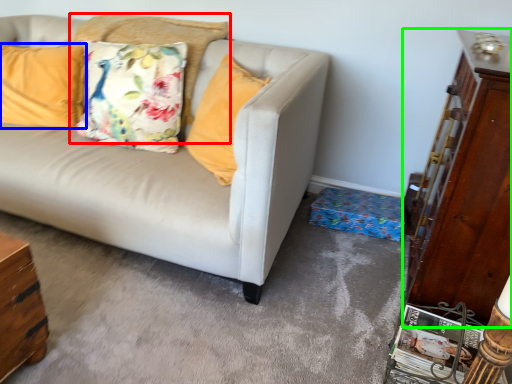
Question: Based on their relative distances, which object is farther from pillow (highlighted by a red box)? Choose from pillow (highlighted by a blue box) and dresser (highlighted by a green box).

Choices:
 (A) pillow
 (B) dresser

Answer: (B)